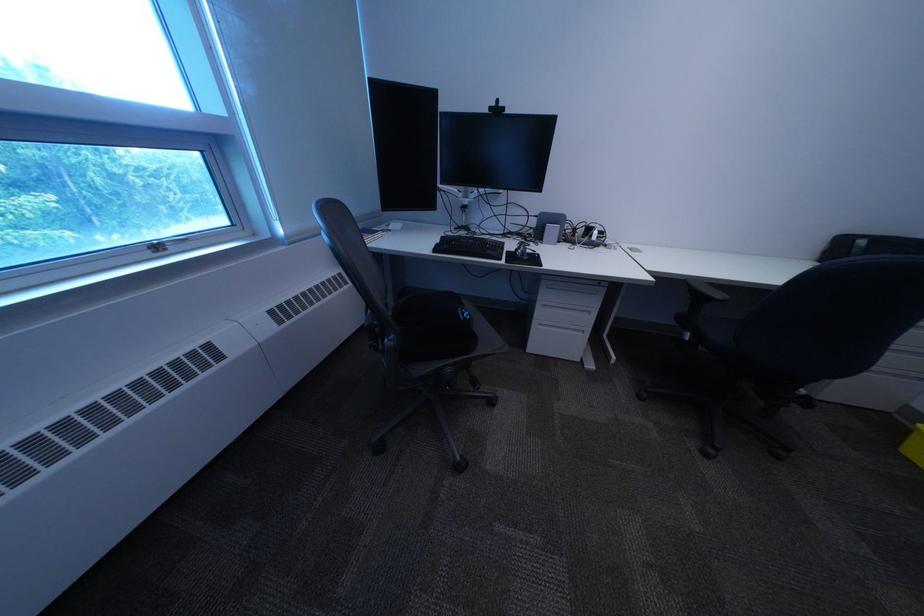
At what (x,y) coordinates should I click in order to perform the action: click on silver window latch. Please return your answer as a coordinate pair (x, y). Image resolution: width=924 pixels, height=616 pixels. Looking at the image, I should click on (157, 246).